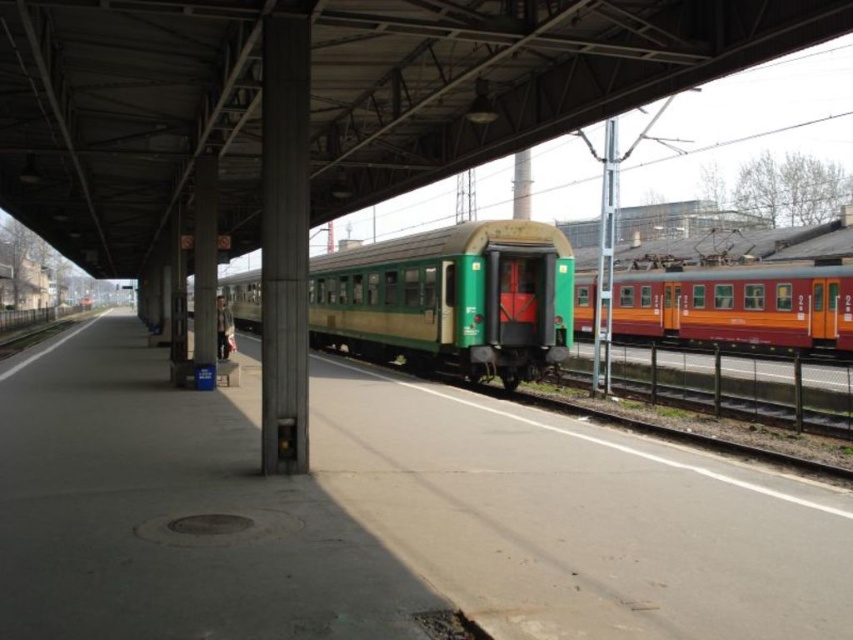
Question: Does green matte train at center appear under matte orange train at right?

Choices:
 (A) yes
 (B) no

Answer: (B)

Question: Which point appears closest to the camera in this image?

Choices:
 (A) (685, 275)
 (B) (503, 355)

Answer: (B)

Question: Observing the image, what is the correct spatial positioning of green matte train at center in reference to matte orange train at right?

Choices:
 (A) right
 (B) left

Answer: (B)

Question: Does green matte train at center have a smaller size compared to matte orange train at right?

Choices:
 (A) no
 (B) yes

Answer: (A)

Question: Among these points, which one is farthest from the camera?

Choices:
 (A) (448, 253)
 (B) (675, 340)

Answer: (B)